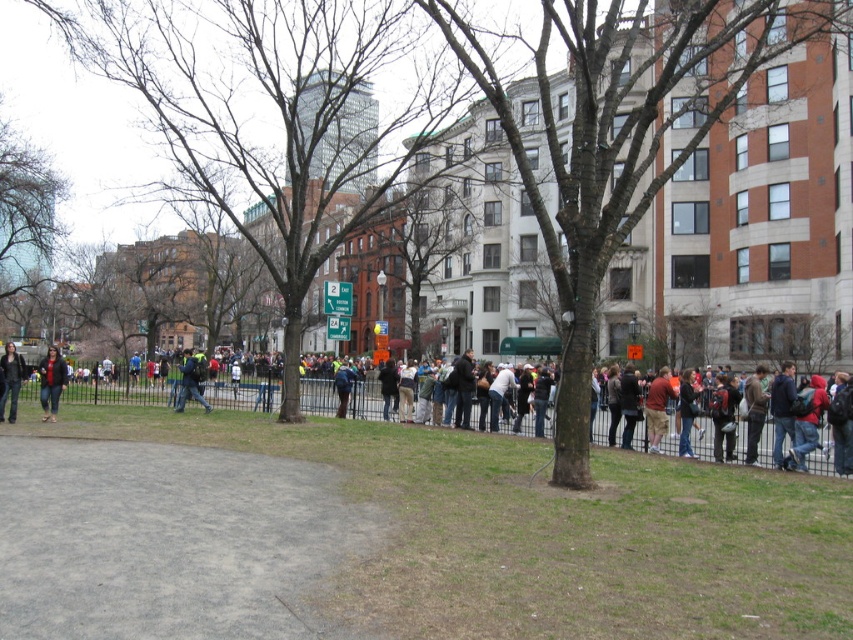
Question: Which object is farther from the camera taking this photo?

Choices:
 (A) bare branches at center
 (B) dark gray jacket at lower left

Answer: (B)

Question: Is bare branches at center to the left of denim jacket at lower left from the viewer's perspective?

Choices:
 (A) no
 (B) yes

Answer: (B)

Question: Which of the following is the farthest from the observer?

Choices:
 (A) pos(537,577)
 (B) pos(9,371)
 (C) pos(225,188)

Answer: (C)

Question: Can you confirm if bare branches at center is positioned above dark blue jeans at center?

Choices:
 (A) yes
 (B) no

Answer: (A)

Question: Is bare branches at center to the left of dark blue backpack at center from the viewer's perspective?

Choices:
 (A) no
 (B) yes

Answer: (B)

Question: Which of the following is the farthest from the observer?

Choices:
 (A) dark blue backpack at center
 (B) blue denim jacket at center

Answer: (B)